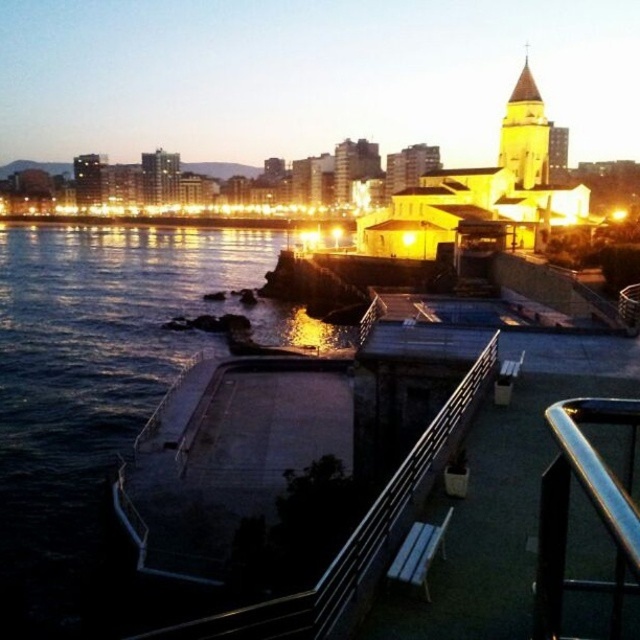
You are an architect designing a new sculpture for the waterfront area. You want to ensure the sculpture will be smaller than the golden stone tower at upper right but larger than the metallic silver bench at lower center. Based on the scene, can you confirm if this is feasible?

Yes, it is feasible because the golden stone tower at upper right is bigger than the metallic silver bench at lower center, so there is a size range between them for the new sculpture.

You are standing at the waterfront and want to take a photo of the golden stone tower at upper right and the metallic silver bench at lower center. Which object should you focus on first if you want both to be in sharp focus?

You should focus on the metallic silver bench at lower center first because it is closer to you than the golden stone tower at upper right. Since the bench is nearer, focusing on it will ensure both objects are in focus due to the depth of field extending backward to the tower.